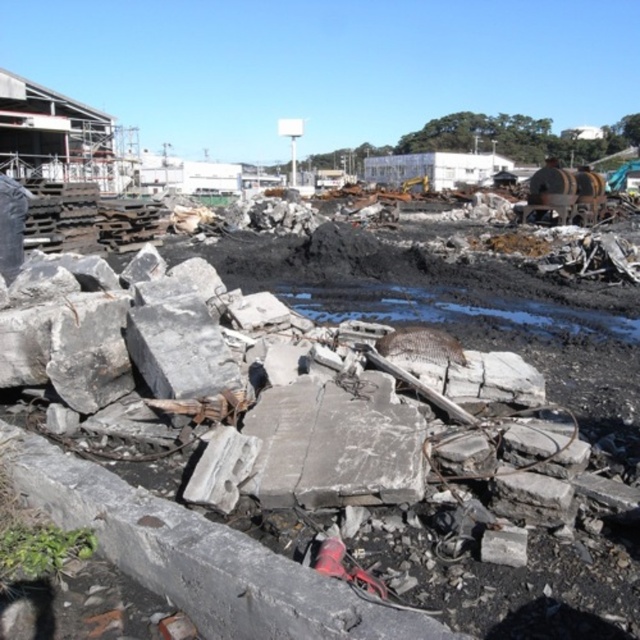
Does point (248, 618) lie behind point (148, 365)?

No, (248, 618) is in front of (148, 365).

Is gray concrete rubble at center below gray concrete block at center?

Indeed, gray concrete rubble at center is positioned under gray concrete block at center.

Is point (257, 572) farther from camera compared to point (172, 378)?

That is False.

Identify the location of gray concrete rubble at center. This screenshot has width=640, height=640. (204, 557).